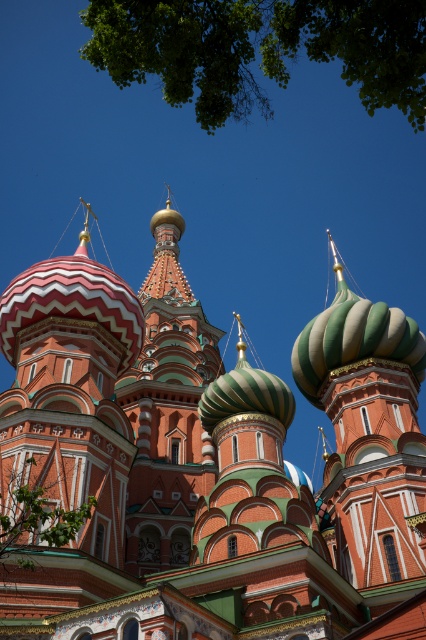
You are standing at the base of the cathedral facing the domes. You notice two points marked in the image. Which point is closer to you, point (121, 561) or point (98, 58)?

Point (98, 58) is closer to you because point (121, 561) is behind it.

You are an architect analyzing the cathedral design. You observe the polychrome mosaic dome at center and the green glossy dome at center. Which dome has a higher peak?

The polychrome mosaic dome at center has a greater height compared to the green glossy dome at center, so the polychrome mosaic dome at center has a higher peak.